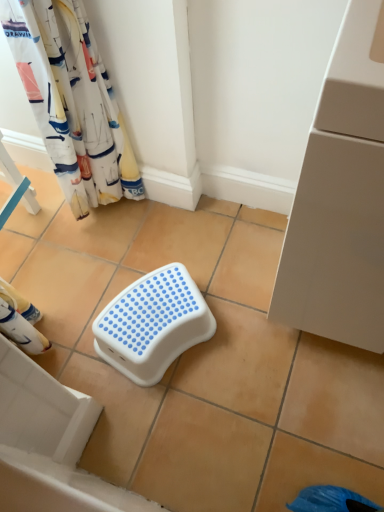
The width and height of the screenshot is (384, 512). Find the location of `vacant region to the right of white plastic step stool at center`. vacant region to the right of white plastic step stool at center is located at coordinates [x=251, y=327].